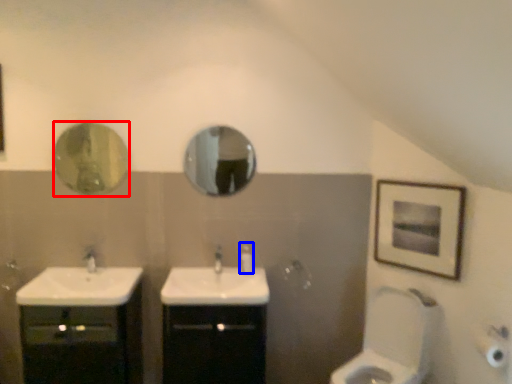
Question: Among these objects, which one is nearest to the camera, mirror (highlighted by a red box) or soap dispenser (highlighted by a blue box)?

Choices:
 (A) mirror
 (B) soap dispenser

Answer: (A)